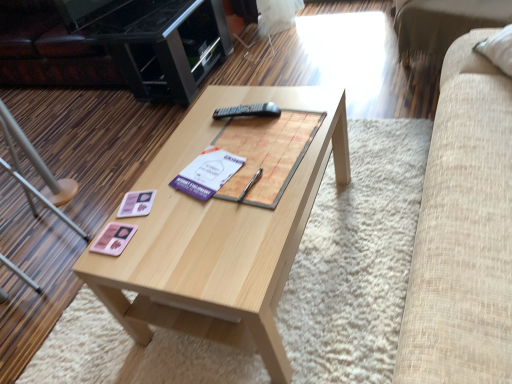
Question: Is light wood coffee table at center to the left of metallic silver chair at lower left from the viewer's perspective?

Choices:
 (A) no
 (B) yes

Answer: (A)

Question: Can metallic silver chair at lower left be found inside light wood coffee table at center?

Choices:
 (A) no
 (B) yes

Answer: (A)

Question: Could you tell me if light wood coffee table at center is turned towards metallic silver chair at lower left?

Choices:
 (A) yes
 (B) no

Answer: (B)

Question: From the image's perspective, is light wood coffee table at center over metallic silver chair at lower left?

Choices:
 (A) no
 (B) yes

Answer: (A)

Question: From a real-world perspective, is light wood coffee table at center physically above metallic silver chair at lower left?

Choices:
 (A) yes
 (B) no

Answer: (B)

Question: From a real-world perspective, is light wood coffee table at center located beneath metallic silver chair at lower left?

Choices:
 (A) yes
 (B) no

Answer: (A)

Question: Does light wood coffee table at center touch black glossy entertainment center at upper left?

Choices:
 (A) yes
 (B) no

Answer: (B)

Question: Does light wood coffee table at center come in front of black glossy entertainment center at upper left?

Choices:
 (A) yes
 (B) no

Answer: (A)

Question: Can you confirm if light wood coffee table at center is wider than black glossy entertainment center at upper left?

Choices:
 (A) yes
 (B) no

Answer: (A)

Question: Can you confirm if light wood coffee table at center is bigger than black glossy entertainment center at upper left?

Choices:
 (A) yes
 (B) no

Answer: (A)

Question: Is light wood coffee table at center not near black glossy entertainment center at upper left?

Choices:
 (A) no
 (B) yes

Answer: (B)

Question: From a real-world perspective, is light wood coffee table at center located beneath black glossy entertainment center at upper left?

Choices:
 (A) yes
 (B) no

Answer: (A)

Question: Is black plastic remote at center taller than pink matte coaster at center-left?

Choices:
 (A) no
 (B) yes

Answer: (A)